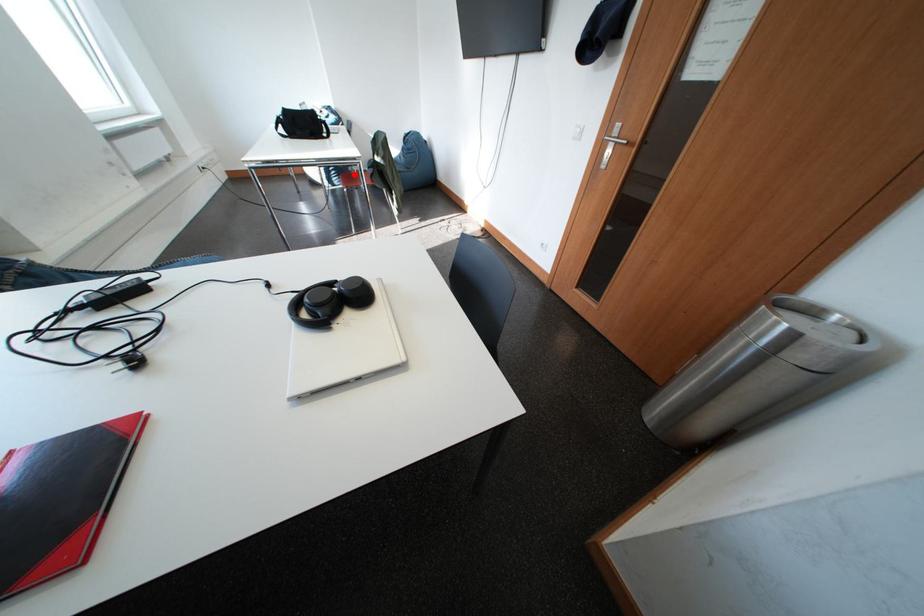
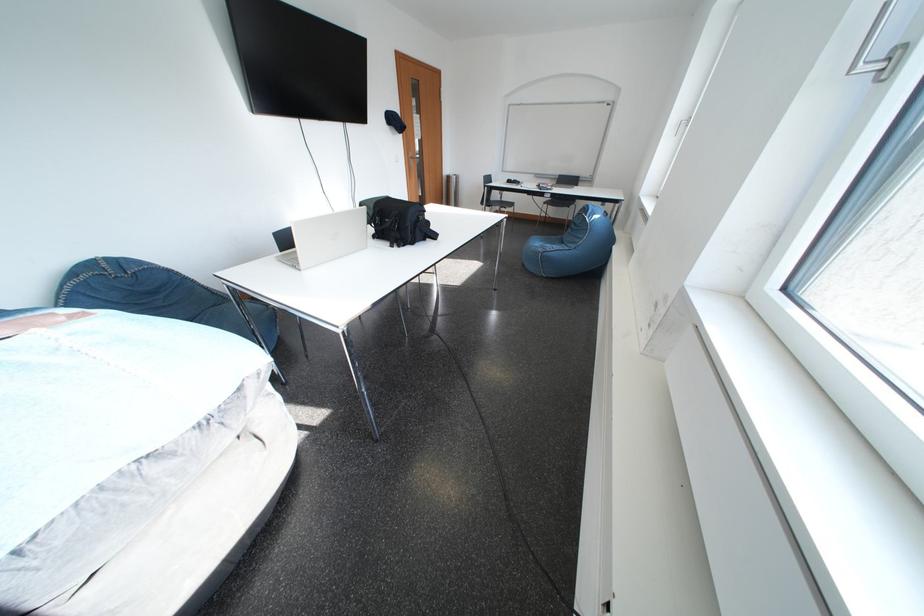
Question: I am providing you with two images of the same scene from different viewpoints. A red point is marked on the first image. Is the red point's position out of view in image 2?

Choices:
 (A) Yes
 (B) No

Answer: (A)